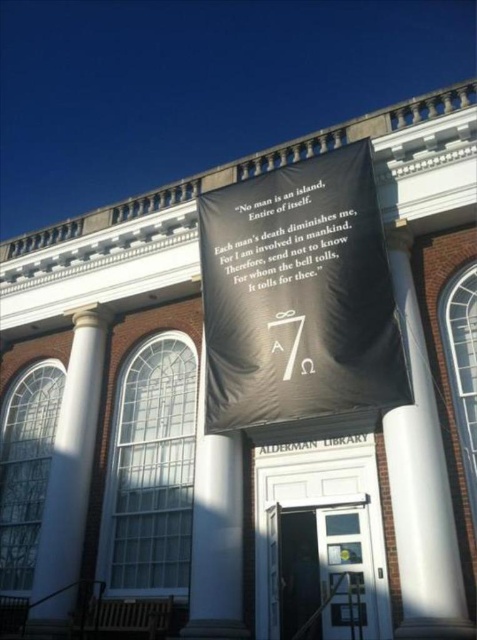
You are an architect designing a new library and want to ensure the columns and banners are proportionate. Given the scene of Alderman Library, which object is wider between the white smooth column at center and the black paper banner at center?

The black paper banner at center is wider than the white smooth column at center.

You are a photographer standing in front of Alderman Library. You notice the black fabric banner at center and the white smooth column at center. Which object is closer to you, the photographer?

The black fabric banner at center is positioned over the white smooth column at center, meaning it is closer to you than the column.

You are standing in front of Alderman Library and notice the black paper banner at center and the white smooth column at left. Which object is closer to you from your current viewpoint?

The black paper banner at center is closer to you than the white smooth column at left, which is positioned behind it.